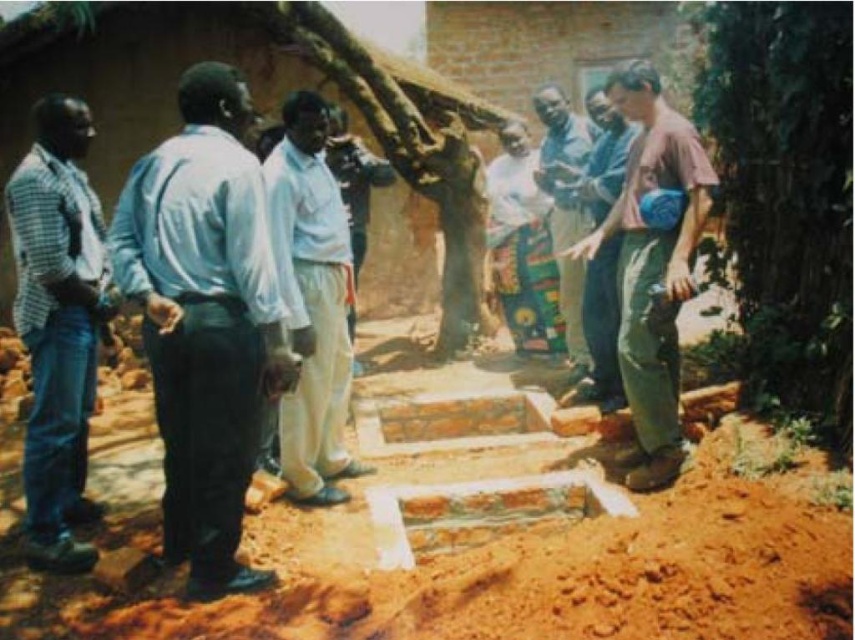
Question: From the image, what is the correct spatial relationship of white matte shirt at center in relation to blue fabric pants at center?

Choices:
 (A) right
 (B) left

Answer: (B)

Question: Estimate the real-world distances between objects in this image. Which object is closer to the blue fabric pants at center?

Choices:
 (A) white matte shirt at center
 (B) pink fabric bag at right
 (C) checkered fabric shirt at left
 (D) light blue shirt at left

Answer: (B)

Question: Is light blue shirt at left to the right of checkered fabric shirt at left from the viewer's perspective?

Choices:
 (A) yes
 (B) no

Answer: (A)

Question: Which point is farther from the camera taking this photo?

Choices:
 (A) (326, 298)
 (B) (600, 362)

Answer: (B)

Question: Which point is farther to the camera?

Choices:
 (A) (544, 90)
 (B) (629, 163)
 (C) (364, 564)
 (D) (254, 163)

Answer: (A)

Question: Does light blue shirt at left have a smaller size compared to blue jeans at right?

Choices:
 (A) no
 (B) yes

Answer: (A)